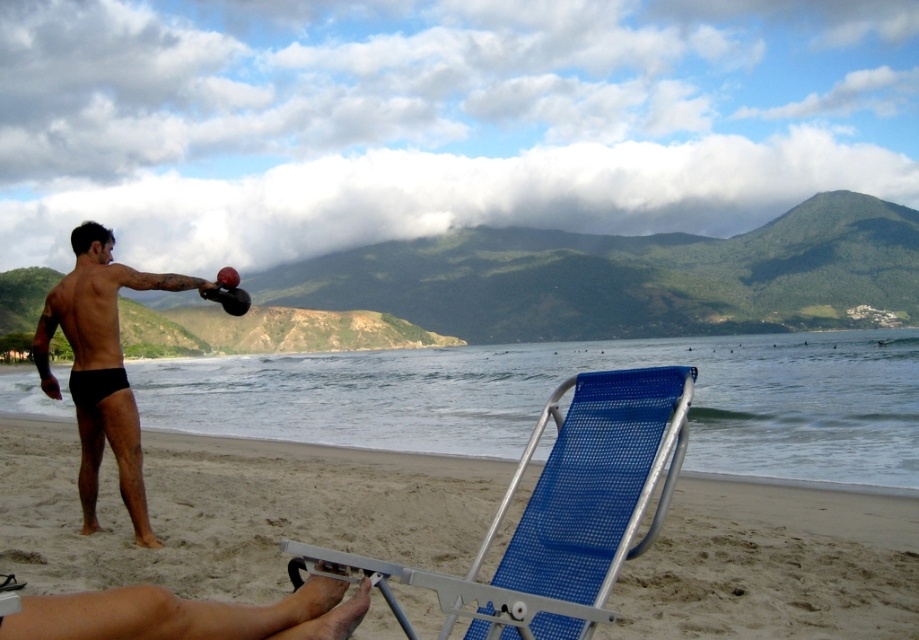
In the scene shown: Is blue mesh beach chair at lower center taller than black matte shorts at left?

No, blue mesh beach chair at lower center is not taller than black matte shorts at left.

Can you confirm if blue mesh beach chair at lower center is thinner than black matte shorts at left?

Indeed, blue mesh beach chair at lower center has a lesser width compared to black matte shorts at left.

Is point (672, 440) positioned after point (121, 355)?

No, (672, 440) is in front of (121, 355).

The width and height of the screenshot is (919, 640). In order to click on blue mesh beach chair at lower center in this screenshot , I will do `click(557, 513)`.

Between point (857, 588) and point (112, 368), which one is positioned behind?

Positioned behind is point (112, 368).

Looking at this image, is blue mesh chair at lower center below black matte shorts at left?

Indeed, blue mesh chair at lower center is positioned under black matte shorts at left.

Is point (155, 440) positioned before point (78, 397)?

No.

Find the location of a particular element. blue mesh chair at lower center is located at coordinates (233, 509).

Is blue mesh chair at lower center below blue mesh beach chair at lower center?

Indeed, blue mesh chair at lower center is positioned under blue mesh beach chair at lower center.

Who is positioned more to the right, blue mesh chair at lower center or blue mesh beach chair at lower center?

From the viewer's perspective, blue mesh beach chair at lower center appears more on the right side.

Between point (758, 595) and point (596, 515), which one is positioned in front?

Positioned in front is point (596, 515).

Where is `blue mesh chair at lower center`? The image size is (919, 640). blue mesh chair at lower center is located at coordinates (233, 509).